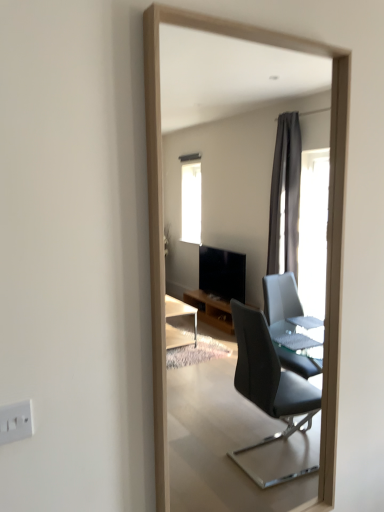
Question: Does white plastic electric outlet at lower left lie in front of wooden frame at center?

Choices:
 (A) no
 (B) yes

Answer: (B)

Question: Is white plastic electric outlet at lower left aimed at wooden frame at center?

Choices:
 (A) no
 (B) yes

Answer: (A)

Question: From a real-world perspective, is white plastic electric outlet at lower left located higher than wooden frame at center?

Choices:
 (A) yes
 (B) no

Answer: (B)

Question: Can you confirm if white plastic electric outlet at lower left is positioned to the left of wooden frame at center?

Choices:
 (A) yes
 (B) no

Answer: (A)

Question: Is white plastic electric outlet at lower left positioned behind wooden frame at center?

Choices:
 (A) yes
 (B) no

Answer: (B)

Question: Can you confirm if white plastic electric outlet at lower left is smaller than wooden frame at center?

Choices:
 (A) yes
 (B) no

Answer: (A)

Question: Does wooden frame at center have a greater height compared to white plastic electric outlet at lower left?

Choices:
 (A) yes
 (B) no

Answer: (A)

Question: Can you see wooden frame at center touching white plastic electric outlet at lower left?

Choices:
 (A) no
 (B) yes

Answer: (A)

Question: Can you confirm if wooden frame at center is thinner than white plastic electric outlet at lower left?

Choices:
 (A) yes
 (B) no

Answer: (B)

Question: Can you confirm if wooden frame at center is bigger than white plastic electric outlet at lower left?

Choices:
 (A) no
 (B) yes

Answer: (B)

Question: Is wooden frame at center looking in the opposite direction of white plastic electric outlet at lower left?

Choices:
 (A) no
 (B) yes

Answer: (A)

Question: Can white plastic electric outlet at lower left be found inside wooden frame at center?

Choices:
 (A) yes
 (B) no

Answer: (B)

Question: From their relative heights in the image, would you say wooden frame at center is taller or shorter than white plastic electric outlet at lower left?

Choices:
 (A) tall
 (B) short

Answer: (A)